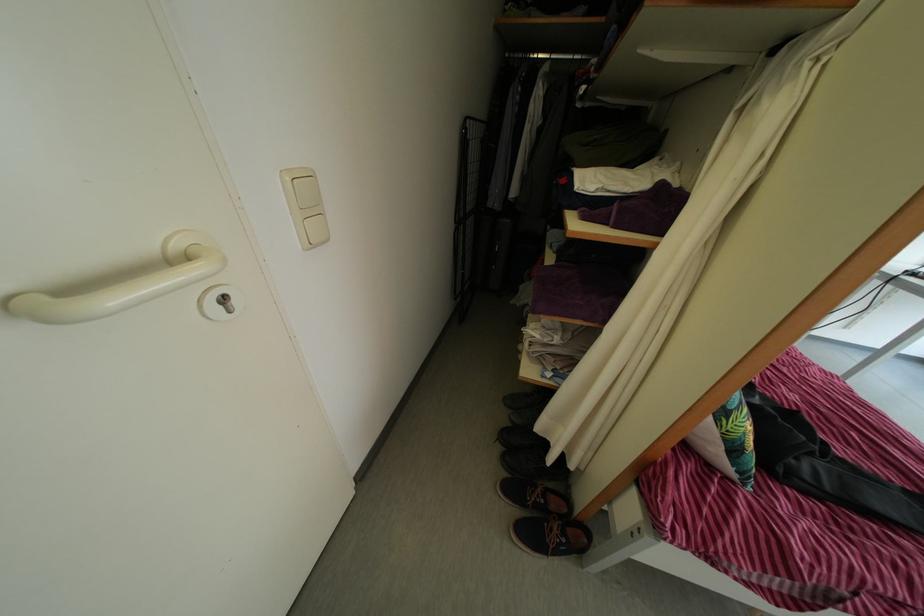
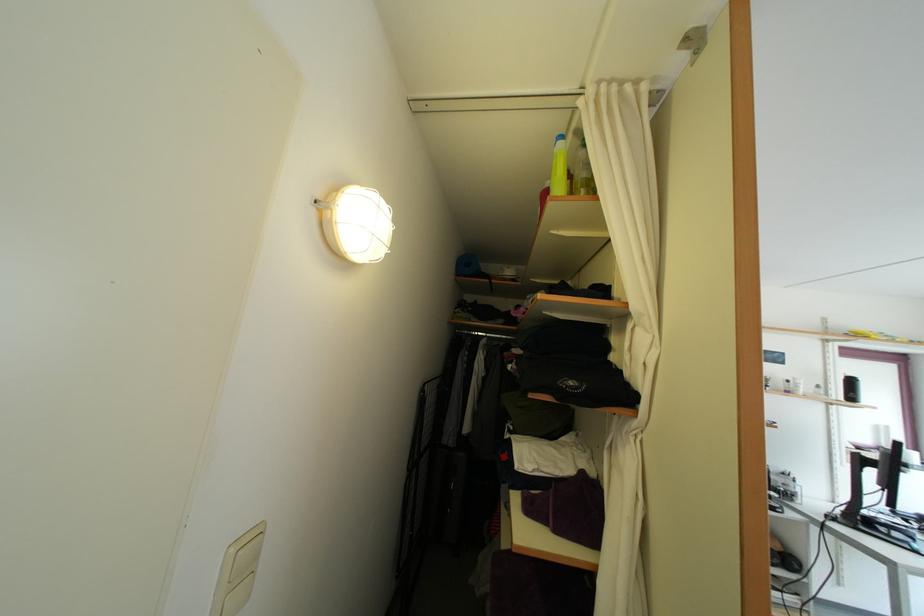
In the second image, find the point that corresponds to (664,252) in the first image.

(602, 576)